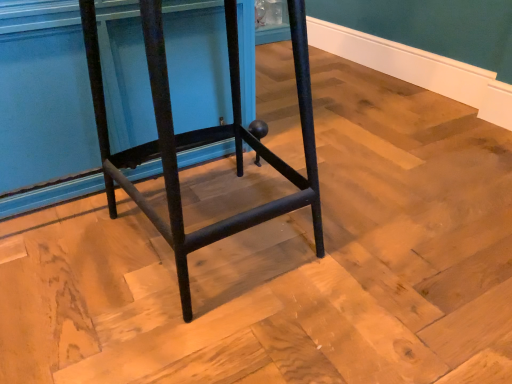
This screenshot has height=384, width=512. What are the coordinates of `free space underneath black metal stool at center (from a real-world perspective)` in the screenshot? It's located at (230, 234).